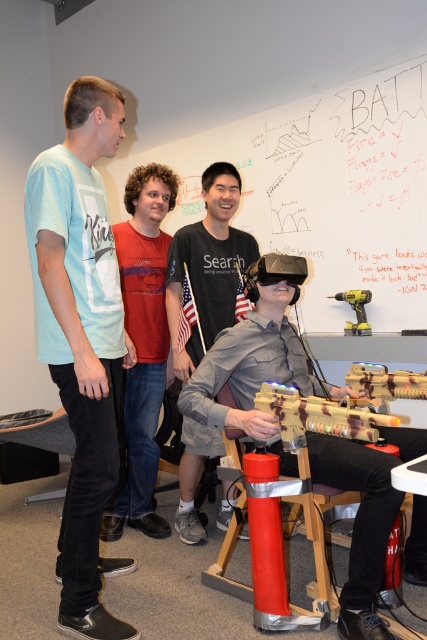
Between matte gray shirt at center and metallic drill at center, which one appears on the left side from the viewer's perspective?

Positioned to the left is matte gray shirt at center.

The width and height of the screenshot is (427, 640). I want to click on matte gray shirt at center, so click(207, 266).

The image size is (427, 640). I want to click on matte gray shirt at center, so click(x=207, y=266).

What do you see at coordinates (81, 337) in the screenshot?
I see `light blue t-shirt at left` at bounding box center [81, 337].

Does light blue t-shirt at left have a lesser width compared to matte gray shirt at center?

Yes, light blue t-shirt at left is thinner than matte gray shirt at center.

Who is more forward, (111,445) or (172,298)?

Positioned in front is point (111,445).

Where is `light blue t-shirt at left`? This screenshot has width=427, height=640. light blue t-shirt at left is located at coordinates [x=81, y=337].

Which is more to the right, light blue t-shirt at left or red cotton shirt at center?

Positioned to the right is red cotton shirt at center.

Can you confirm if light blue t-shirt at left is positioned to the left of red cotton shirt at center?

Indeed, light blue t-shirt at left is positioned on the left side of red cotton shirt at center.

The height and width of the screenshot is (640, 427). What are the coordinates of `light blue t-shirt at left` in the screenshot? It's located at (81, 337).